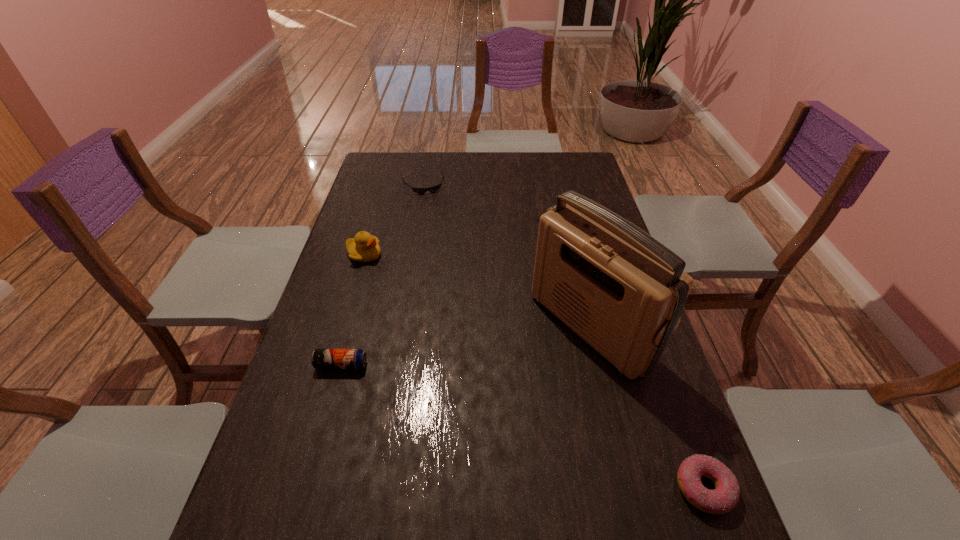
Locate an element on the screen. Image resolution: width=960 pixels, height=540 pixels. beer can is located at coordinates (321, 358).

This screenshot has width=960, height=540. In order to click on doughnut in this screenshot , I will do click(x=725, y=496).

The image size is (960, 540). Identify the location of the fourth nearest object. (364, 248).

Find the location of a particular element. This screenshot has height=540, width=960. duckling is located at coordinates (364, 248).

This screenshot has width=960, height=540. I want to click on radio receiver, so click(x=622, y=291).

The image size is (960, 540). Identify the location of the shortest object. (432, 189).

Image resolution: width=960 pixels, height=540 pixels. Find the location of `the farthest object`. the farthest object is located at coordinates (432, 189).

Find the location of `vacant space located 0.330m on the back of the beer can`. vacant space located 0.330m on the back of the beer can is located at coordinates (368, 268).

This screenshot has width=960, height=540. What are the coordinates of `free space located 0.370m on the back of the nearest object` in the screenshot? It's located at (645, 325).

Locate an element on the screen. This screenshot has width=960, height=540. vacant area situated on the front-facing side of the second tallest object is located at coordinates (434, 348).